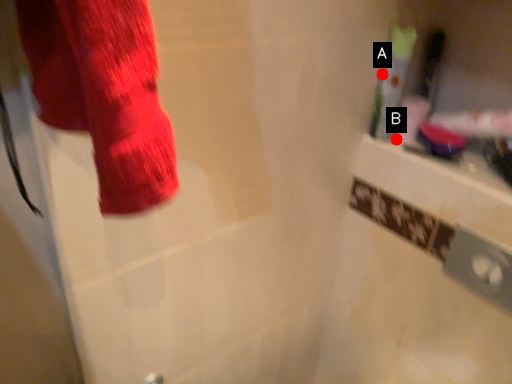
Question: Two points are circled on the image, labeled by A and B beside each circle. Which point appears farthest from the camera in this image?

Choices:
 (A) A is further
 (B) B is further

Answer: (B)